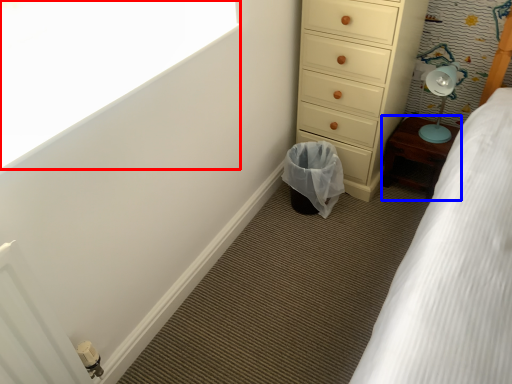
Question: Which point is further to the camera, window screen (highlighted by a red box) or furniture (highlighted by a blue box)?

Choices:
 (A) window screen
 (B) furniture

Answer: (B)